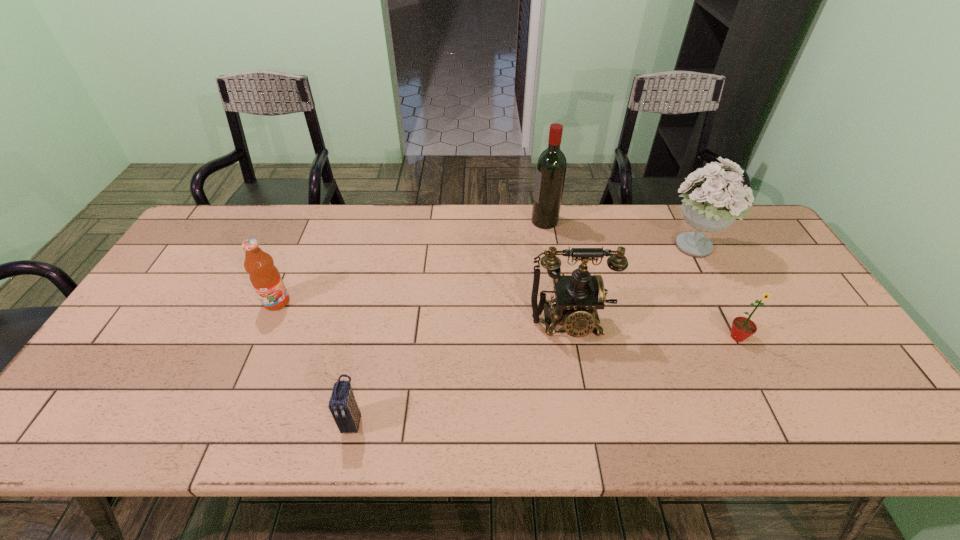
Locate an element on the screen. This screenshot has width=960, height=540. free point between the wine bottle and the bouquet is located at coordinates (619, 235).

Locate an element on the screen. This screenshot has height=540, width=960. vacant area that lies between the leftmost object and the second shortest object is located at coordinates (507, 319).

You are a GUI agent. You are given a task and a screenshot of the screen. Output one action in this format:
    pyautogui.click(x=<x>, y=<y>)
    Task: Click on the free space between the bouquet and the telephone
    
    Given the screenshot: What is the action you would take?
    pyautogui.click(x=631, y=286)

Locate an element on the screen. free area in between the sunflower and the bouquet is located at coordinates (715, 293).

Image resolution: width=960 pixels, height=540 pixels. Find the location of `vacant space that's between the fifth object from right to left and the leftmost object`. vacant space that's between the fifth object from right to left and the leftmost object is located at coordinates (315, 361).

Find the location of a particular element. The width and height of the screenshot is (960, 540). object that is the second closest one to the nearest object is located at coordinates (578, 296).

Find the location of `object that stands as the second closest to the wine bottle`. object that stands as the second closest to the wine bottle is located at coordinates (578, 296).

Image resolution: width=960 pixels, height=540 pixels. Identify the location of vacant area that satisfies the following two spatial constraints: 1. on the label of the wine bottle; 2. on the front label of the fourth tallest object. pyautogui.click(x=559, y=302).

I want to click on vacant position in the image that satisfies the following two spatial constraints: 1. on the label of the wine bottle; 2. on the right side of the bouquet, so point(549,248).

Image resolution: width=960 pixels, height=540 pixels. I want to click on free space that satisfies the following two spatial constraints: 1. on the label of the wine bottle; 2. with the zip open on the nearest object, so pos(578,421).